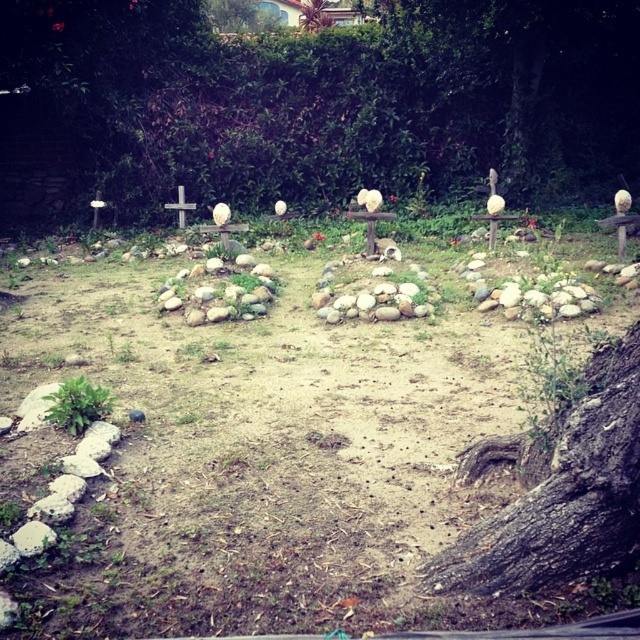
Question: Can you confirm if green leafy tree at center is positioned below green leafy tree at upper center?

Choices:
 (A) yes
 (B) no

Answer: (A)

Question: Which point is closer to the camera taking this photo?

Choices:
 (A) (572, 116)
 (B) (412, 458)

Answer: (B)

Question: Which object appears farthest from the camera in this image?

Choices:
 (A) white wooden cross at center
 (B) green leafy tree at center

Answer: (B)

Question: Which point is closer to the camera?

Choices:
 (A) (28, 573)
 (B) (310, 6)

Answer: (A)

Question: Can you confirm if smooth stone circle at center is thinner than white wooden cross at center?

Choices:
 (A) no
 (B) yes

Answer: (A)

Question: Observing the image, what is the correct spatial positioning of smooth stone circle at center in reference to green leafy tree at upper center?

Choices:
 (A) above
 (B) below

Answer: (B)